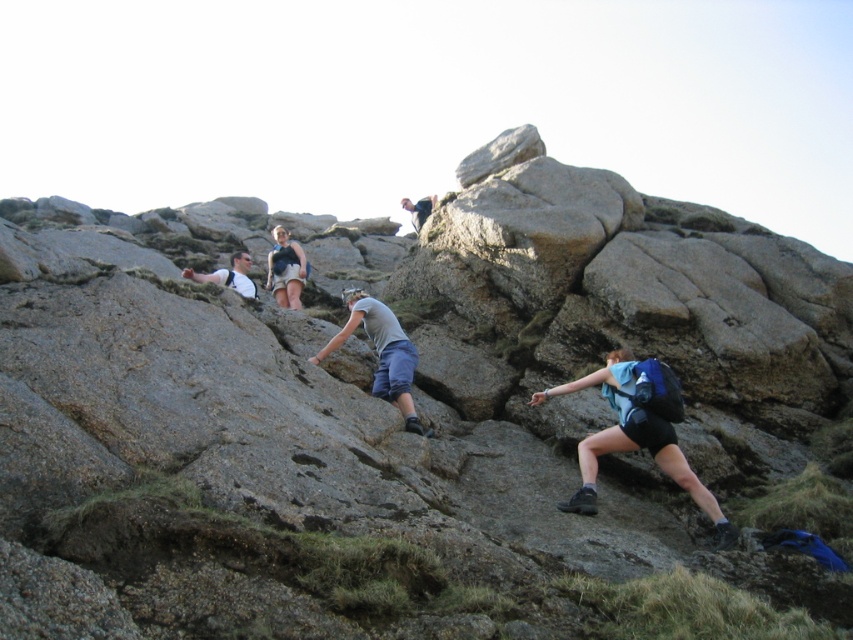
Is gray fabric pants at center further to camera compared to matte gray shirt at lower left?

No, it is in front of matte gray shirt at lower left.

In the scene shown: Is gray fabric pants at center in front of matte gray shirt at lower left?

That is True.

Locate an element on the screen. This screenshot has width=853, height=640. gray fabric pants at center is located at coordinates (381, 353).

Can you confirm if blue fabric backpack at lower right is taller than matte gray shirt at lower left?

Indeed, blue fabric backpack at lower right has a greater height compared to matte gray shirt at lower left.

Does blue fabric backpack at lower right have a larger size compared to matte gray shirt at lower left?

Actually, blue fabric backpack at lower right might be smaller than matte gray shirt at lower left.

Between point (601, 387) and point (198, 278), which one is positioned behind?

The point (198, 278) is more distant.

This screenshot has width=853, height=640. Find the location of `blue fabric backpack at lower right`. blue fabric backpack at lower right is located at coordinates (637, 432).

Who is more forward, (605, 381) or (358, 289)?

Positioned in front is point (605, 381).

Is blue fabric backpack at lower right thinner than gray fabric pants at center?

No.

Who is more forward, (689,490) or (390,388)?

Positioned in front is point (689,490).

Locate an element on the screen. This screenshot has height=640, width=853. blue fabric backpack at lower right is located at coordinates (637, 432).